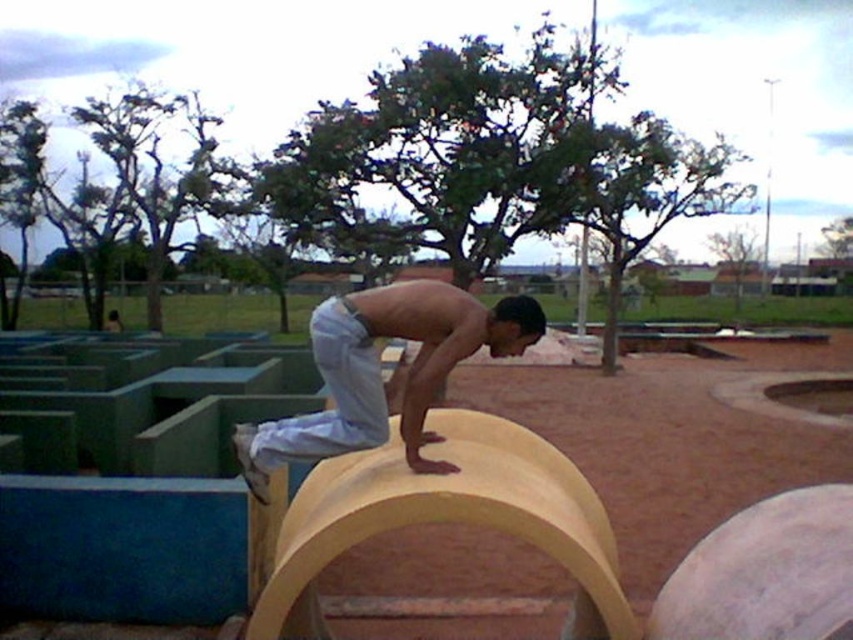
Does yellow matte obstacle at center have a larger size compared to light blue denim pants at center?

Yes, yellow matte obstacle at center is bigger than light blue denim pants at center.

Is point (708, 454) closer to viewer compared to point (432, 378)?

That is False.

Where is `yellow matte obstacle at center`? yellow matte obstacle at center is located at coordinates (683, 428).